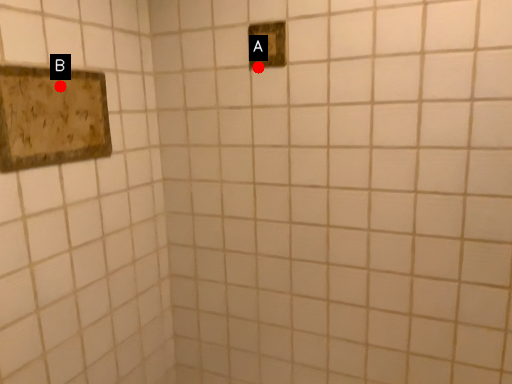
Question: Two points are circled on the image, labeled by A and B beside each circle. Which point is closer to the camera?

Choices:
 (A) A is closer
 (B) B is closer

Answer: (B)